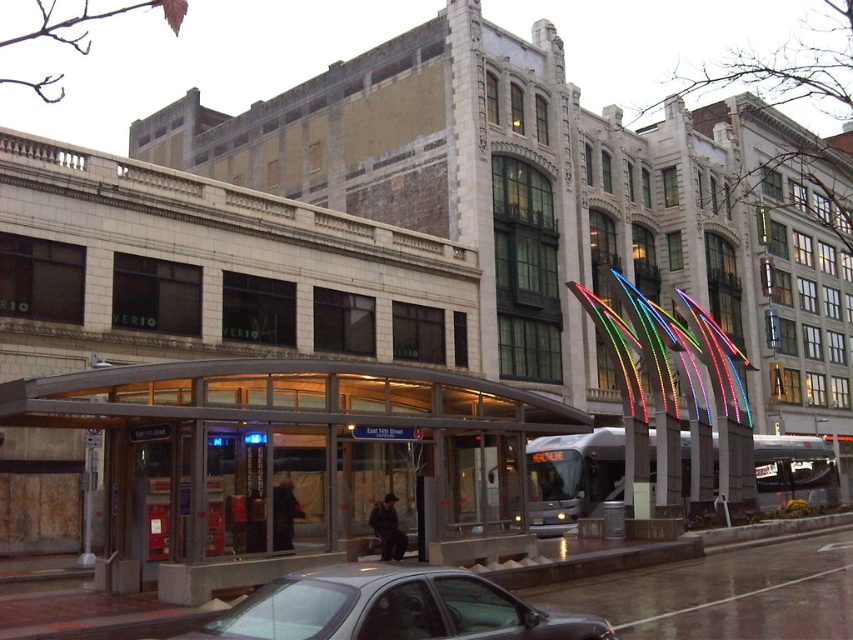
You are a pedestrian standing at the bus stop shelter on East 14th Street. You see the neon lights at center and the metallic gray sedan at lower center. Which object is positioned higher from the ground?

The neon lights at center is above metallic gray sedan at lower center, so the neon lights at center is positioned higher from the ground.

Consider the image. You are a delivery person needing to pass through the area between the translucent glass bus stop at center and the neon lights at center. The delivery cart is 1.2 meters wide. Can you fit through the space between them?

The translucent glass bus stop at center is wider than the neon lights at center. However, since the exact width of the space between them isn not specified, it is uncertain whether the 1.2 meter wide delivery cart can fit through.

You are a pedestrian standing at the bus stop shelter on East 14th Street. You need to cross the street to reach the building with the word VERIO. Which object between the neon lights at center and the metallic gray sedan at lower center is closer to you as you prepare to cross?

The neon lights at center are closer to you since they are further to the viewer than the metallic gray sedan at lower center, meaning they are positioned nearer in the scene.